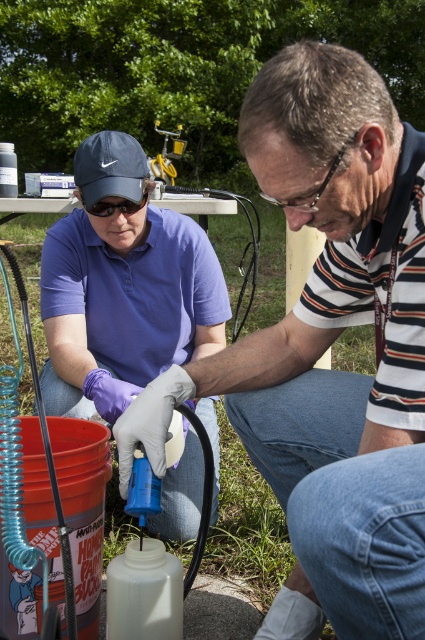
Question: Where is white matte glove at lower left located in relation to clear plastic goggles at center in the image?

Choices:
 (A) right
 (B) left

Answer: (B)

Question: Which point is closer to the camera?

Choices:
 (A) white matte glove at lower left
 (B) purple fabric shirt at center
 (C) clear plastic goggles at center
 (D) matte black goggles at upper left

Answer: (A)

Question: Which object is closer to the camera taking this photo?

Choices:
 (A) clear plastic goggles at center
 (B) purple fabric shirt at center
 (C) white matte glove at lower left
 (D) matte black goggles at upper left

Answer: (C)

Question: Does white matte glove at lower left have a greater width compared to clear plastic goggles at center?

Choices:
 (A) no
 (B) yes

Answer: (B)

Question: Observing the image, what is the correct spatial positioning of white matte glove at lower left in reference to matte black goggles at upper left?

Choices:
 (A) below
 (B) above

Answer: (A)

Question: Which point is closer to the camera taking this photo?

Choices:
 (A) (132, 202)
 (B) (98, 276)

Answer: (A)